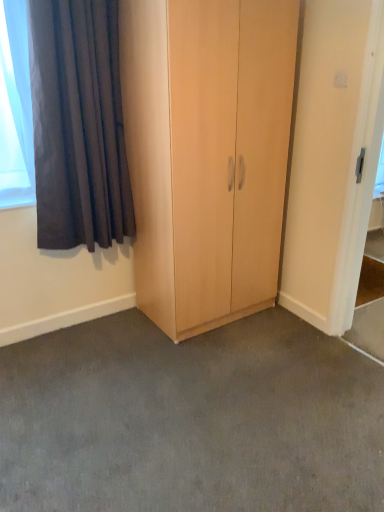
Question: Is white glossy screen door at upper right bigger than light wood cupboard at center?

Choices:
 (A) yes
 (B) no

Answer: (B)

Question: Is there a large distance between white glossy screen door at upper right and light wood cupboard at center?

Choices:
 (A) yes
 (B) no

Answer: (B)

Question: Can you confirm if white glossy screen door at upper right is shorter than light wood cupboard at center?

Choices:
 (A) no
 (B) yes

Answer: (B)

Question: From a real-world perspective, does white glossy screen door at upper right sit lower than light wood cupboard at center?

Choices:
 (A) no
 (B) yes

Answer: (B)

Question: Are white glossy screen door at upper right and light wood cupboard at center making contact?

Choices:
 (A) no
 (B) yes

Answer: (A)

Question: Would you say white glossy screen door at upper right is outside light wood cupboard at center?

Choices:
 (A) yes
 (B) no

Answer: (A)

Question: Would you say gray carpet at center contains dark grey velvet curtain at upper left?

Choices:
 (A) no
 (B) yes

Answer: (A)

Question: Is gray carpet at center wider than dark grey velvet curtain at upper left?

Choices:
 (A) yes
 (B) no

Answer: (A)

Question: From the image's perspective, does gray carpet at center appear higher than dark grey velvet curtain at upper left?

Choices:
 (A) yes
 (B) no

Answer: (B)

Question: Is gray carpet at center completely or partially outside of dark grey velvet curtain at upper left?

Choices:
 (A) no
 (B) yes

Answer: (B)

Question: From a real-world perspective, is gray carpet at center positioned over dark grey velvet curtain at upper left based on gravity?

Choices:
 (A) no
 (B) yes

Answer: (A)

Question: Is gray carpet at center touching dark grey velvet curtain at upper left?

Choices:
 (A) no
 (B) yes

Answer: (A)

Question: Considering the relative positions of light wood cupboard at center and dark grey velvet curtain at upper left in the image provided, is light wood cupboard at center behind dark grey velvet curtain at upper left?

Choices:
 (A) yes
 (B) no

Answer: (B)